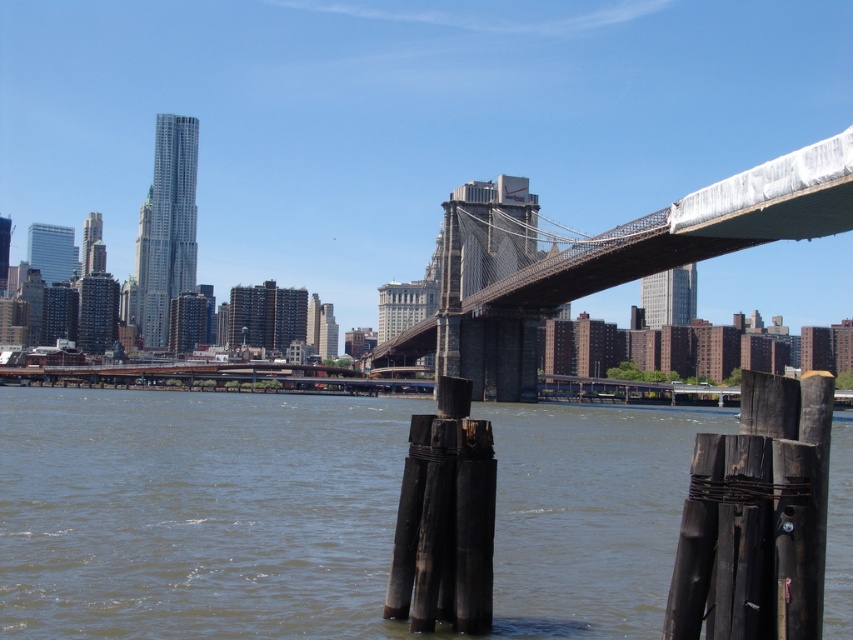
Question: Which point appears closest to the camera in this image?

Choices:
 (A) (512, 611)
 (B) (668, 211)

Answer: (A)

Question: Is brown wooden posts at lower center to the left of metallic gray bridge at center from the viewer's perspective?

Choices:
 (A) no
 (B) yes

Answer: (B)

Question: Can you confirm if brown wooden posts at lower center is positioned to the left of metallic gray bridge at center?

Choices:
 (A) no
 (B) yes

Answer: (B)

Question: Can you confirm if brown wooden posts at lower center is smaller than metallic gray bridge at center?

Choices:
 (A) no
 (B) yes

Answer: (B)

Question: Which of the following is the closest to the observer?

Choices:
 (A) brown wooden posts at lower center
 (B) metallic gray bridge at center

Answer: (A)